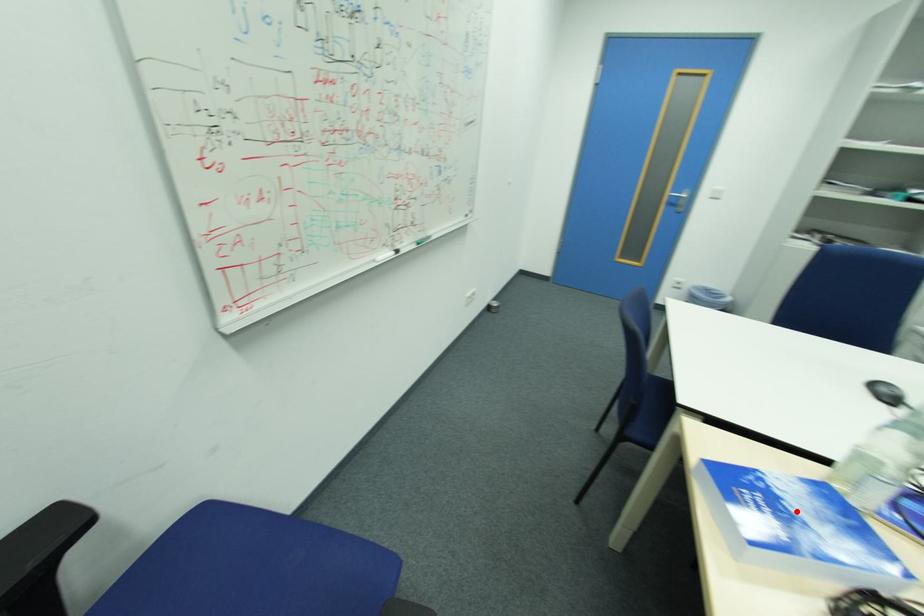
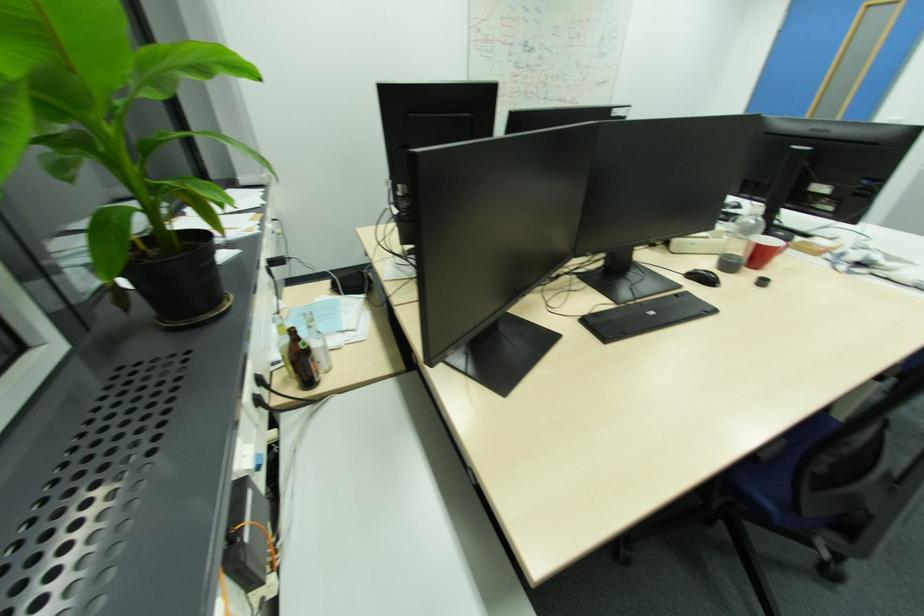
Question: I am providing you with two images of the same scene from different viewpoints. A red point is marked on the first image. Can you still see the location of the red point in image 2?

Choices:
 (A) Yes
 (B) No

Answer: (B)